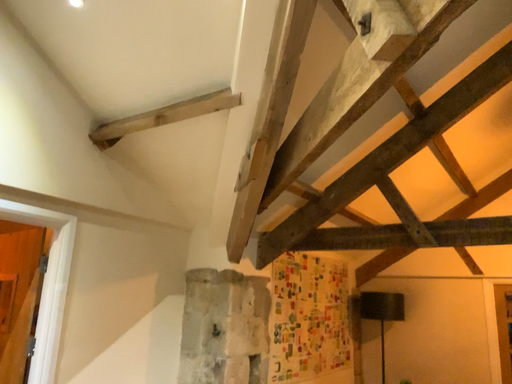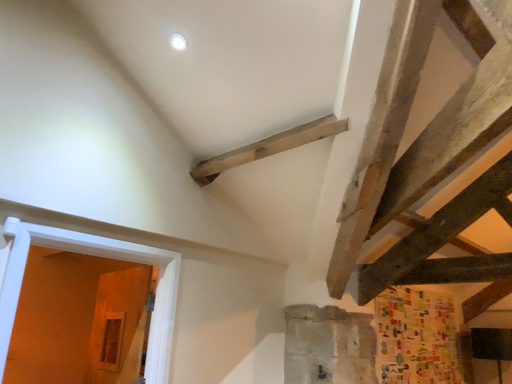
Question: Which way did the camera rotate in the video?

Choices:
 (A) rotated right
 (B) rotated left

Answer: (B)